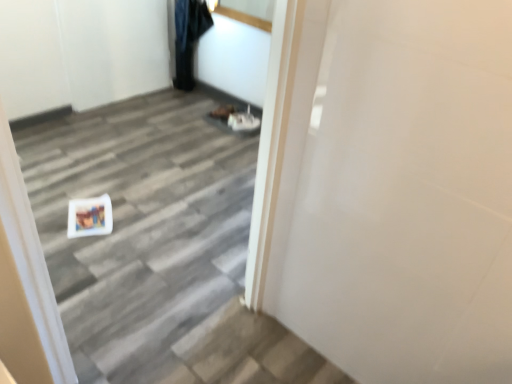
Describe the element at coordinates (141, 226) in the screenshot. I see `white glossy door at center` at that location.

You are a GUI agent. You are given a task and a screenshot of the screen. Output one action in this format:
    pyautogui.click(x=<x>, y=<y>)
    Task: Click on the white glossy door at center
    The image size is (512, 384).
    Given the screenshot: What is the action you would take?
    (x=141, y=226)

Describe the element at coordinates (188, 38) in the screenshot. I see `denim pants at upper center` at that location.

I want to click on denim pants at upper center, so click(188, 38).

Measure the distance between point (196, 13) and camera.

They are 11.04 feet apart.

The image size is (512, 384). Find the location of `white glossy door at center`. white glossy door at center is located at coordinates (141, 226).

Can you confirm if denim pants at upper center is positioned to the right of white glossy door at center?

No, denim pants at upper center is not to the right of white glossy door at center.

Is denim pants at upper center in front of or behind white glossy door at center in the image?

In the image, denim pants at upper center appears behind white glossy door at center.

Does point (186, 6) lie behind point (153, 272)?

Yes.

From the image's perspective, between denim pants at upper center and white glossy door at center, which one is located above?

denim pants at upper center.

From a real-world perspective, is denim pants at upper center physically located above or below white glossy door at center?

denim pants at upper center is below white glossy door at center.

Which object is thinner, denim pants at upper center or white glossy door at center?

With smaller width is white glossy door at center.

Does denim pants at upper center have a greater height compared to white glossy door at center?

No, denim pants at upper center is not taller than white glossy door at center.

Considering the sizes of objects denim pants at upper center and white glossy door at center in the image provided, who is bigger, denim pants at upper center or white glossy door at center?

white glossy door at center.

Is denim pants at upper center situated inside white glossy door at center or outside?

denim pants at upper center is not enclosed by white glossy door at center.

Is denim pants at upper center with white glossy door at center?

denim pants at upper center is not next to white glossy door at center, and they're not touching.

Does denim pants at upper center turn towards white glossy door at center?

No, denim pants at upper center is not facing towards white glossy door at center.

How many degrees apart are the facing directions of denim pants at upper center and white glossy door at center?

The facing directions of denim pants at upper center and white glossy door at center are 72.7 degrees apart.

How far apart are denim pants at upper center and white glossy door at center?

A distance of 4.26 feet exists between denim pants at upper center and white glossy door at center.

What are the coordinates of `garment behind the white glossy door at center` in the screenshot? It's located at (188, 38).

Is white glossy door at center at the right side of denim pants at upper center?

Indeed, white glossy door at center is positioned on the right side of denim pants at upper center.

Is white glossy door at center further to camera compared to denim pants at upper center?

That is False.

Which is further, (147, 211) or (179, 73)?

Point (179, 73)

From the image's perspective, between white glossy door at center and denim pants at upper center, which one is located above?

denim pants at upper center is shown above in the image.

From a real-world perspective, is white glossy door at center above or below denim pants at upper center?

white glossy door at center is above denim pants at upper center.

Considering the sizes of white glossy door at center and denim pants at upper center in the image, is white glossy door at center wider or thinner than denim pants at upper center?

Considering their sizes, white glossy door at center looks slimmer than denim pants at upper center.

Considering the sizes of white glossy door at center and denim pants at upper center in the image, is white glossy door at center taller or shorter than denim pants at upper center?

Considering their sizes, white glossy door at center has more height than denim pants at upper center.

Can you confirm if white glossy door at center is smaller than denim pants at upper center?

Actually, white glossy door at center might be larger than denim pants at upper center.

Which is correct: white glossy door at center is inside denim pants at upper center, or outside of it?

white glossy door at center lies outside denim pants at upper center.

Is white glossy door at center far from denim pants at upper center?

Yes, white glossy door at center and denim pants at upper center are located far from each other.

Is denim pants at upper center at the back of white glossy door at center?

white glossy door at center is not turned away from denim pants at upper center.

How different are the orientations of white glossy door at center and denim pants at upper center in degrees?

72.7 degrees.

Where is `stairwell that is on the right side of denim pants at upper center`? Image resolution: width=512 pixels, height=384 pixels. stairwell that is on the right side of denim pants at upper center is located at coordinates (141, 226).

Where is `stairwell above the denim pants at upper center (from a real-world perspective)`? The image size is (512, 384). stairwell above the denim pants at upper center (from a real-world perspective) is located at coordinates (141, 226).

In the image, there is a white glossy door at center. In order to click on garment below it (from a real-world perspective) in this screenshot , I will do `click(188, 38)`.